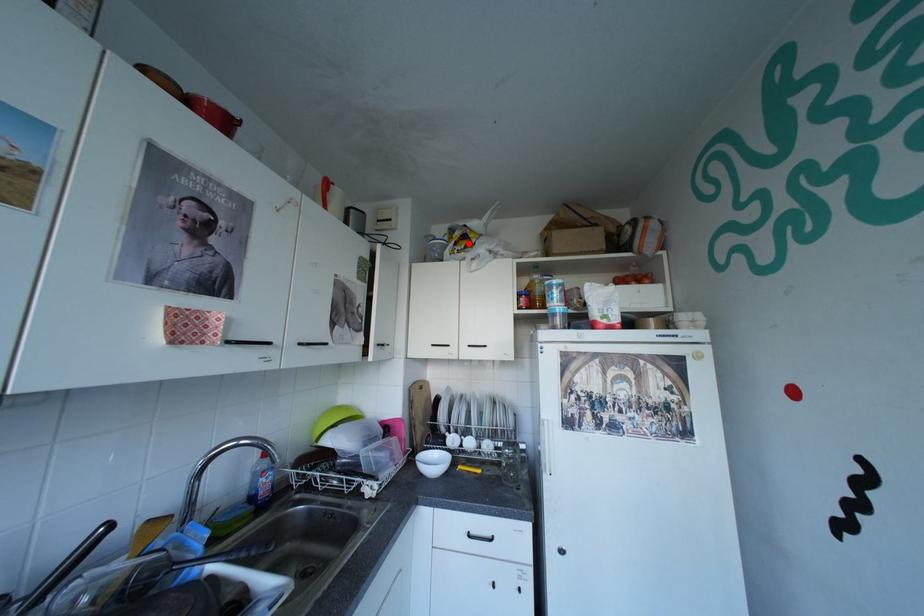
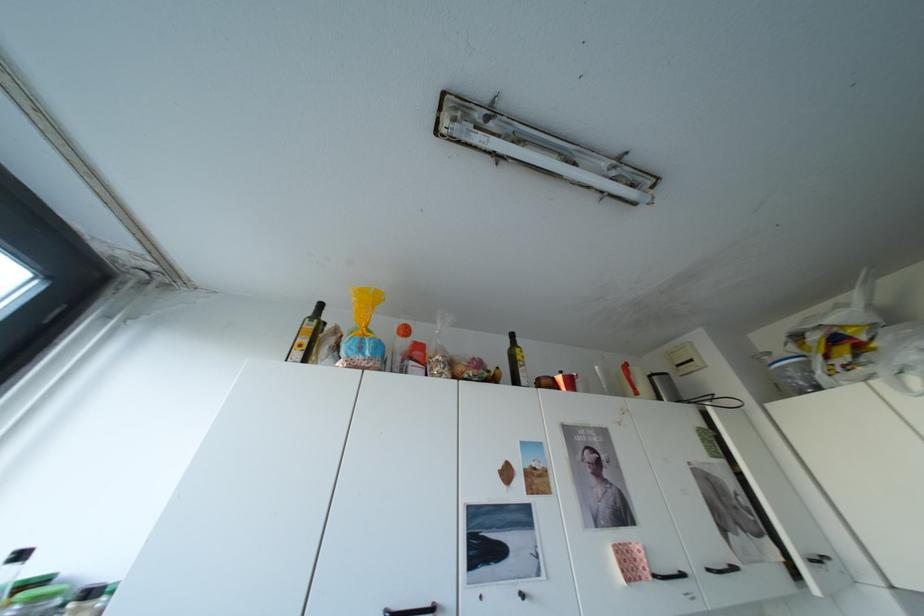
In the second image, find the point that corresponds to the highlighted location in the first image.

(840, 357)